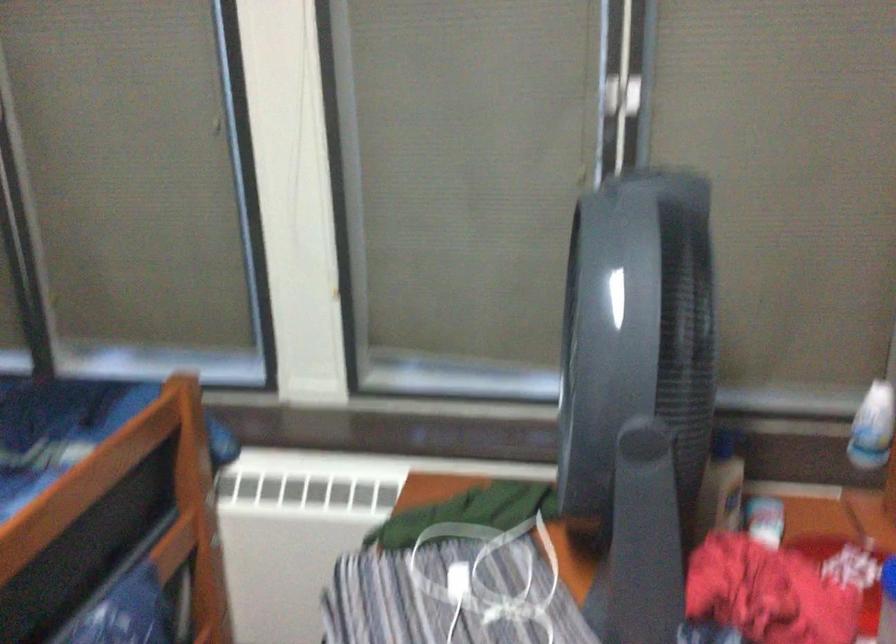
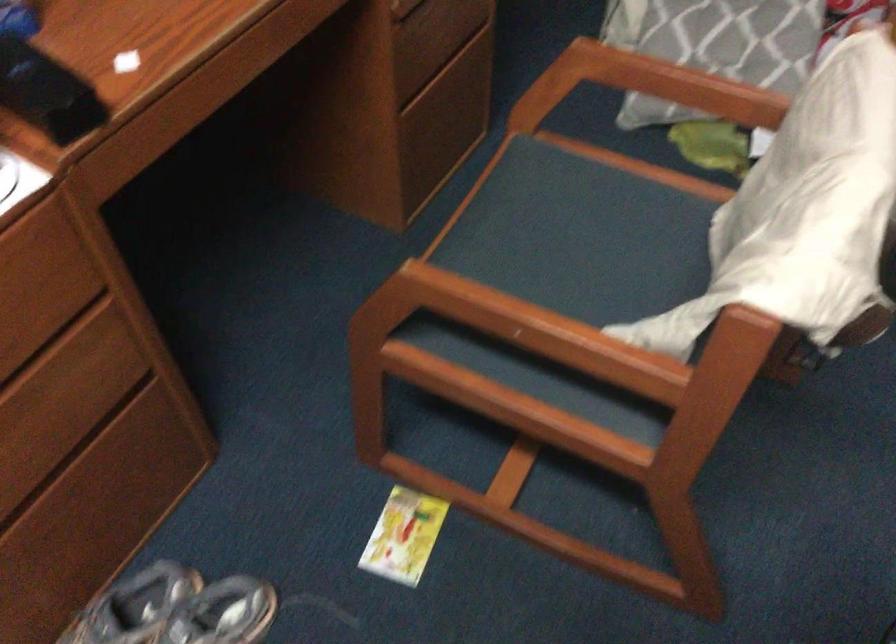
The first image is from the beginning of the video and the second image is from the end. How did the camera likely rotate when shooting the video?

The rotation direction of the camera is right-down.